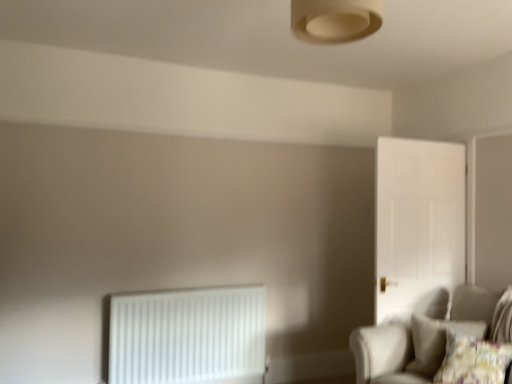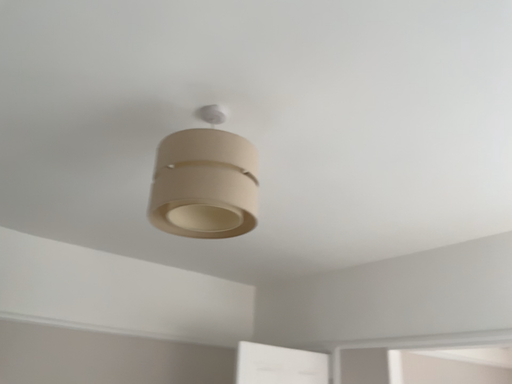
Question: Which way did the camera rotate in the video?

Choices:
 (A) rotated left
 (B) rotated right

Answer: (B)